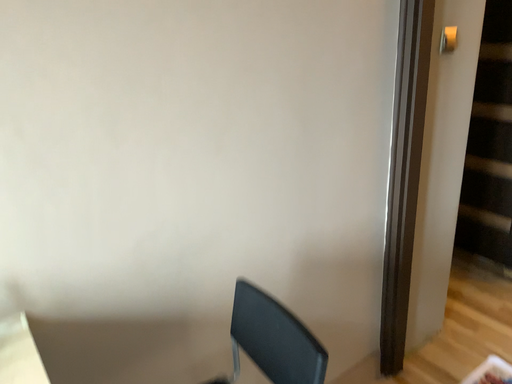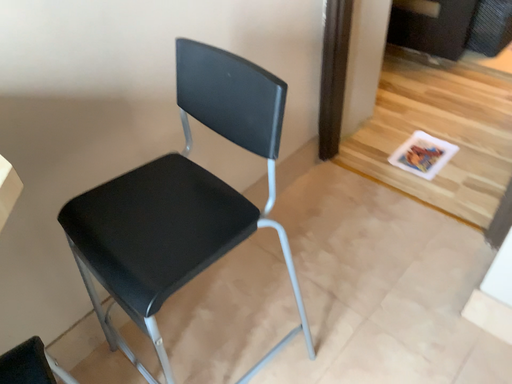
Question: Which way did the camera rotate in the video?

Choices:
 (A) rotated right
 (B) rotated left

Answer: (A)